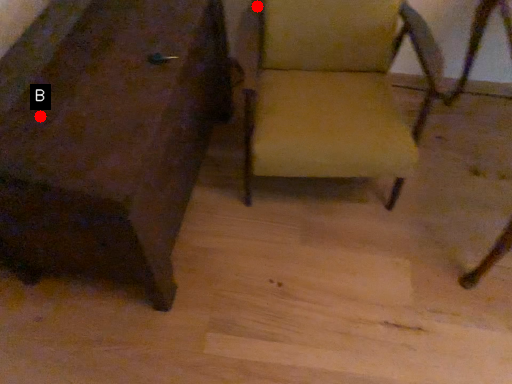
Question: Two points are circled on the image, labeled by A and B beside each circle. Which of the following is the farthest from the observer?

Choices:
 (A) A is further
 (B) B is further

Answer: (A)